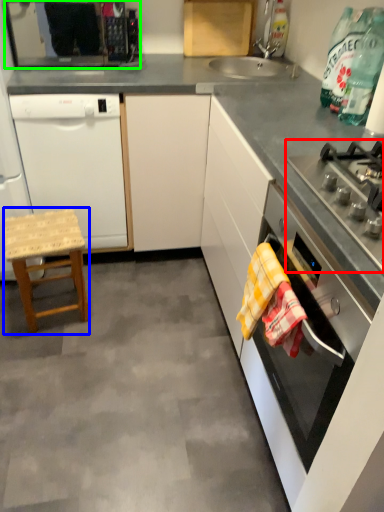
Question: Based on their relative distances, which object is nearer to gas stove (highlighted by a red box)? Choose from stool (highlighted by a blue box) and kitchen appliance (highlighted by a green box).

Choices:
 (A) stool
 (B) kitchen appliance

Answer: (A)